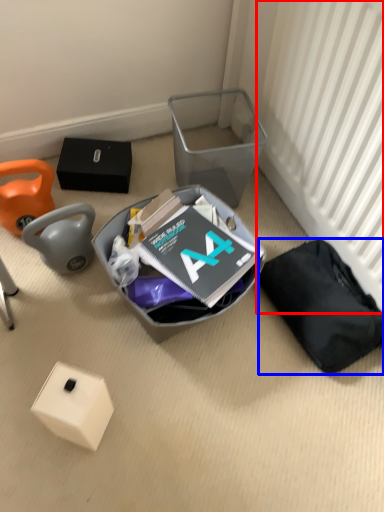
Question: Which of the following is the closest to the observer, radiator (highlighted by a red box) or waste (highlighted by a blue box)?

Choices:
 (A) radiator
 (B) waste

Answer: (A)